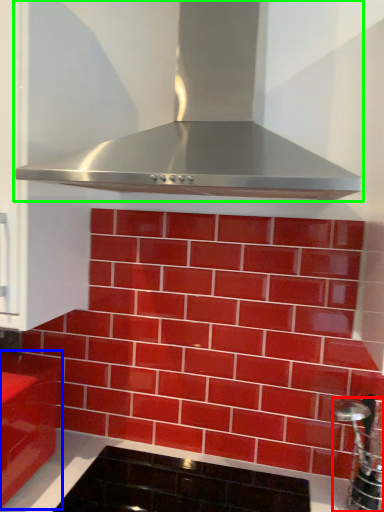
Question: Which is farther away from stainless steel (highlighted by a red box)? cabinetry (highlighted by a blue box) or home appliance (highlighted by a green box)?

Choices:
 (A) cabinetry
 (B) home appliance

Answer: (A)